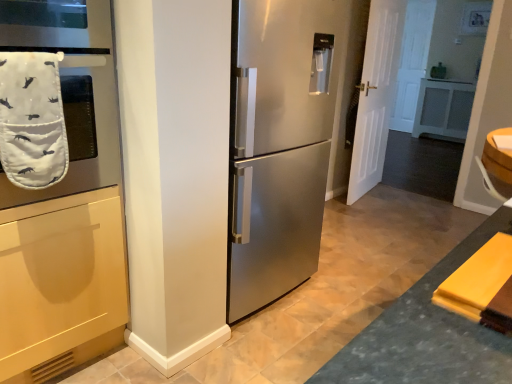
This screenshot has height=384, width=512. What do you see at coordinates (32, 119) in the screenshot? I see `white quilted oven mitt at left` at bounding box center [32, 119].

Where is `white quilted oven mitt at left`? white quilted oven mitt at left is located at coordinates (32, 119).

This screenshot has width=512, height=384. What do you see at coordinates (279, 144) in the screenshot?
I see `stainless steel refrigerator at center` at bounding box center [279, 144].

Locate an element on the screen. Image resolution: width=512 pixels, height=384 pixels. white quilted oven mitt at left is located at coordinates (32, 119).

Is white matte door at right not close to stainless steel refrigerator at center?

Yes, white matte door at right and stainless steel refrigerator at center are located far from each other.

Can we say white matte door at right lies outside stainless steel refrigerator at center?

That's correct, white matte door at right is outside of stainless steel refrigerator at center.

How distant is white matte door at right from stainless steel refrigerator at center?

The distance of white matte door at right from stainless steel refrigerator at center is 1.70 meters.

Considering the sizes of objects white matte door at right and stainless steel refrigerator at center in the image provided, who is wider, white matte door at right or stainless steel refrigerator at center?

stainless steel refrigerator at center is wider.

Image resolution: width=512 pixels, height=384 pixels. What are the coordinates of `oven above the stainless steel refrigerator at center (from the image's perspective)` in the screenshot? It's located at (71, 89).

From a real-world perspective, does stainless steel refrigerator at center sit lower than white fabric oven mitt at left?

Yes, from a real-world perspective, stainless steel refrigerator at center is under white fabric oven mitt at left.

Is stainless steel refrigerator at center to the right of white fabric oven mitt at left from the viewer's perspective?

Correct, you'll find stainless steel refrigerator at center to the right of white fabric oven mitt at left.

From the image's perspective, which is above, stainless steel refrigerator at center or white fabric oven mitt at left?

From the image's view, white fabric oven mitt at left is above.

From the image's perspective, is white matte door at right on top of white fabric oven mitt at left?

Yes, from the image's perspective, white matte door at right is over white fabric oven mitt at left.

Based on the photo, considering the relative sizes of white matte door at right and white fabric oven mitt at left in the image provided, is white matte door at right bigger than white fabric oven mitt at left?

No.

Is white matte door at right oriented towards white fabric oven mitt at left?

No, white matte door at right is not facing towards white fabric oven mitt at left.

In the scene shown: Is white matte door at right surrounding white fabric oven mitt at left?

No.

Is white quilted oven mitt at left aimed at white fabric oven mitt at left?

No, white quilted oven mitt at left does not turn towards white fabric oven mitt at left.

From the image's perspective, is white quilted oven mitt at left under white fabric oven mitt at left?

Indeed, from the image's perspective, white quilted oven mitt at left is shown beneath white fabric oven mitt at left.

Are white quilted oven mitt at left and white fabric oven mitt at left making contact?

white quilted oven mitt at left and white fabric oven mitt at left are not in contact.

From a real-world perspective, which object rests below the other?

From a 3D spatial view, white quilted oven mitt at left is below.

Is white quilted oven mitt at left smaller than stainless steel refrigerator at center?

Correct, white quilted oven mitt at left occupies less space than stainless steel refrigerator at center.

In the scene shown: Between white quilted oven mitt at left and stainless steel refrigerator at center, which one is positioned behind?

Positioned behind is stainless steel refrigerator at center.

Where is `refrigerator that is behind the white quilted oven mitt at left`? Image resolution: width=512 pixels, height=384 pixels. refrigerator that is behind the white quilted oven mitt at left is located at coordinates (279, 144).

Is white quilted oven mitt at left aimed at stainless steel refrigerator at center?

No, white quilted oven mitt at left is not facing towards stainless steel refrigerator at center.

From the image's perspective, relative to white matte door at right, is white fabric oven mitt at left above or below?

From the image's perspective, white fabric oven mitt at left appears below white matte door at right.

Is white fabric oven mitt at left not close to white matte door at right?

Yes, white fabric oven mitt at left is far from white matte door at right.

Is white fabric oven mitt at left not inside white matte door at right?

Yes, white fabric oven mitt at left is not within white matte door at right.

Can you confirm if white fabric oven mitt at left is shorter than white matte door at right?

Yes, white fabric oven mitt at left is shorter than white matte door at right.

In the scene shown: Considering the relative sizes of white fabric oven mitt at left and white quilted oven mitt at left in the image provided, is white fabric oven mitt at left smaller than white quilted oven mitt at left?

Incorrect, white fabric oven mitt at left is not smaller in size than white quilted oven mitt at left.

Based on the photo, from the image's perspective, is white fabric oven mitt at left positioned above or below white quilted oven mitt at left?

Clearly, from the image's perspective, white fabric oven mitt at left is above white quilted oven mitt at left.

Which is further, (64,178) or (42,96)?

Point (64,178)

Locate an element on the screen. The image size is (512, 384). door positioned vertically above the stainless steel refrigerator at center (from a real-world perspective) is located at coordinates (376, 95).

What are the coordinates of `refrigerator behind the white fabric oven mitt at left` in the screenshot? It's located at (279, 144).

When comparing their distances from white quilted oven mitt at left, does white matte door at right or white fabric oven mitt at left seem further?

The object further to white quilted oven mitt at left is white matte door at right.

Which object lies nearer to the anchor point stainless steel refrigerator at center, white quilted oven mitt at left or white fabric oven mitt at left?

Based on the image, white fabric oven mitt at left appears to be nearer to stainless steel refrigerator at center.

Based on their spatial positions, is stainless steel refrigerator at center or white quilted oven mitt at left further from white fabric oven mitt at left?

The object further to white fabric oven mitt at left is stainless steel refrigerator at center.

Which object lies further to the anchor point stainless steel refrigerator at center, white matte door at right or white fabric oven mitt at left?

white matte door at right lies further to stainless steel refrigerator at center than the other object.

Estimate the real-world distances between objects in this image. Which object is closer to stainless steel refrigerator at center, white fabric oven mitt at left or white matte door at right?

white fabric oven mitt at left.

Which object lies nearer to the anchor point stainless steel refrigerator at center, white fabric oven mitt at left or white quilted oven mitt at left?

Based on the image, white fabric oven mitt at left appears to be nearer to stainless steel refrigerator at center.

Which object lies nearer to the anchor point white quilted oven mitt at left, white matte door at right or stainless steel refrigerator at center?

stainless steel refrigerator at center.

Estimate the real-world distances between objects in this image. Which object is closer to white matte door at right, white fabric oven mitt at left or white quilted oven mitt at left?

The object closer to white matte door at right is white fabric oven mitt at left.

Locate an element on the screen. refrigerator located between white fabric oven mitt at left and white matte door at right in the depth direction is located at coordinates (279, 144).

Locate an element on the screen. The image size is (512, 384). refrigerator between white quilted oven mitt at left and white matte door at right in the front-back direction is located at coordinates (279, 144).

Image resolution: width=512 pixels, height=384 pixels. I want to click on bath towel between white fabric oven mitt at left and stainless steel refrigerator at center from left to right, so (32, 119).

Where is `bath towel between white fabric oven mitt at left and white matte door at right in the front-back direction`? bath towel between white fabric oven mitt at left and white matte door at right in the front-back direction is located at coordinates (32, 119).